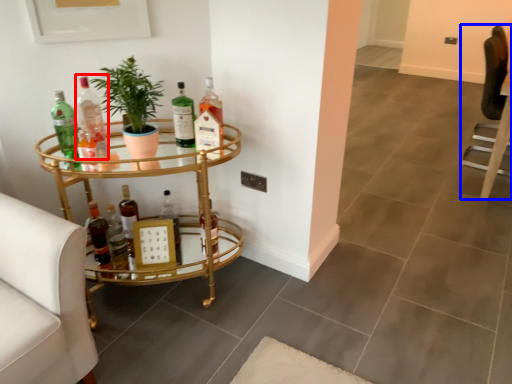
Question: Among these objects, which one is farthest to the camera, bottle (highlighted by a red box) or swivel chair (highlighted by a blue box)?

Choices:
 (A) bottle
 (B) swivel chair

Answer: (B)